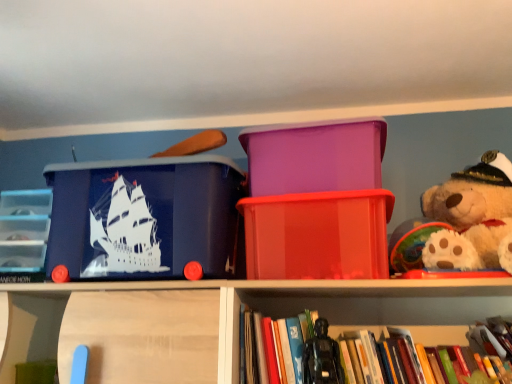
Question: Does matte blue plastic storage box at left, the 1th storage box from the left, appear on the right side of purple plastic container at center, the second storage box viewed from the right?

Choices:
 (A) yes
 (B) no

Answer: (B)

Question: Considering the relative sizes of matte blue plastic storage box at left, the 1th storage box from the left, and purple plastic container at center, the second storage box positioned from the left, in the image provided, is matte blue plastic storage box at left, the 1th storage box from the left, smaller than purple plastic container at center, the second storage box positioned from the left,?

Choices:
 (A) yes
 (B) no

Answer: (B)

Question: Is matte blue plastic storage box at left, the 1th storage box from the left, closer to camera compared to purple plastic container at center, the second storage box viewed from the right?

Choices:
 (A) no
 (B) yes

Answer: (B)

Question: Is purple plastic container at center, the second storage box positioned from the left, surrounded by matte blue plastic storage box at left, the 1th storage box from the left?

Choices:
 (A) no
 (B) yes

Answer: (A)

Question: From a real-world perspective, is matte blue plastic storage box at left, the 1th storage box from the left, physically above purple plastic container at center, the second storage box positioned from the left?

Choices:
 (A) yes
 (B) no

Answer: (B)

Question: Can you confirm if matte blue plastic storage box at left, which is counted as the 3th storage box, starting from the right, is wider than purple plastic container at center, the second storage box viewed from the right?

Choices:
 (A) no
 (B) yes

Answer: (A)

Question: Considering the relative sizes of clear plastic drawers at left and purple plastic container at center, the second storage box positioned from the left, in the image provided, is clear plastic drawers at left bigger than purple plastic container at center, the second storage box positioned from the left,?

Choices:
 (A) no
 (B) yes

Answer: (A)

Question: From a real-world perspective, is clear plastic drawers at left located higher than purple plastic container at center, the second storage box positioned from the left?

Choices:
 (A) yes
 (B) no

Answer: (B)

Question: Can you confirm if clear plastic drawers at left is thinner than purple plastic container at center, the second storage box viewed from the right?

Choices:
 (A) no
 (B) yes

Answer: (B)

Question: Would you consider clear plastic drawers at left to be distant from purple plastic container at center, the second storage box viewed from the right?

Choices:
 (A) yes
 (B) no

Answer: (B)

Question: Would you say purple plastic container at center, the second storage box viewed from the right, is part of clear plastic drawers at left's contents?

Choices:
 (A) yes
 (B) no

Answer: (B)

Question: Considering the relative sizes of clear plastic drawers at left and purple plastic container at center, the second storage box viewed from the right, in the image provided, is clear plastic drawers at left shorter than purple plastic container at center, the second storage box viewed from the right,?

Choices:
 (A) yes
 (B) no

Answer: (B)

Question: Is hardcover book at center surrounding purple plastic container at center, the second storage box viewed from the right?

Choices:
 (A) no
 (B) yes

Answer: (A)